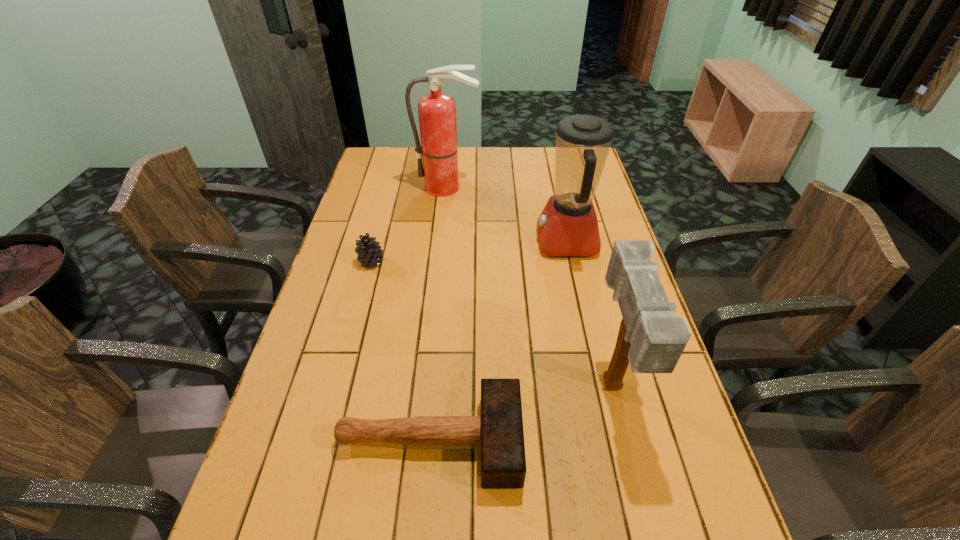
Find the location of `vacant area that lies between the blender and the shorter mallet`. vacant area that lies between the blender and the shorter mallet is located at coordinates (498, 341).

You are a GUI agent. You are given a task and a screenshot of the screen. Output one action in this format:
    pyautogui.click(x=<x>, y=<y>)
    Task: Click on the vacant point located between the fourth tallest object and the shortest object
    This screenshot has height=540, width=960.
    Given the screenshot: What is the action you would take?
    pyautogui.click(x=400, y=351)

Locate which object ranks in proximity to the shorter mallet. Please provide its 2D coordinates. Your answer should be formatted as a tuple, i.e. [(x, y)], where the tuple contains the x and y coordinates of a point satisfying the conditions above.

[(651, 338)]

Locate which object is the closest to the shortest object. Please provide its 2D coordinates. Your answer should be formatted as a tuple, i.e. [(x, y)], where the tuple contains the x and y coordinates of a point satisfying the conditions above.

[(651, 338)]

This screenshot has width=960, height=540. What are the coordinates of `vacant space that satisfies the following two spatial constraints: 1. with the handle and hose on the fire extinguisher; 2. on the left side of the third shortest object` in the screenshot? It's located at (428, 387).

Where is `free space that satisfies the following two spatial constraints: 1. on the front side of the pinecone; 2. on the left side of the right mallet`? The image size is (960, 540). free space that satisfies the following two spatial constraints: 1. on the front side of the pinecone; 2. on the left side of the right mallet is located at coordinates (338, 387).

Locate an element on the screen. free space in the image that satisfies the following two spatial constraints: 1. with the handle and hose on the fire extinguisher; 2. on the right side of the taller mallet is located at coordinates (428, 387).